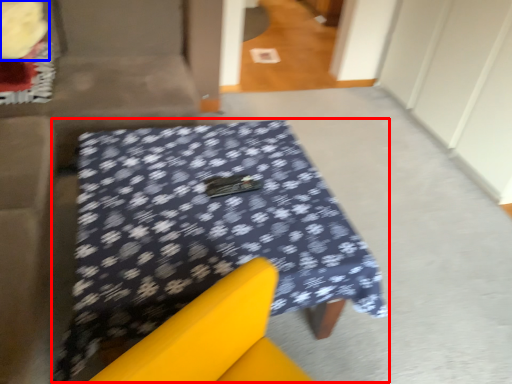
Question: Which object is closer to the camera taking this photo, table (highlighted by a red box) or flower (highlighted by a blue box)?

Choices:
 (A) table
 (B) flower

Answer: (A)